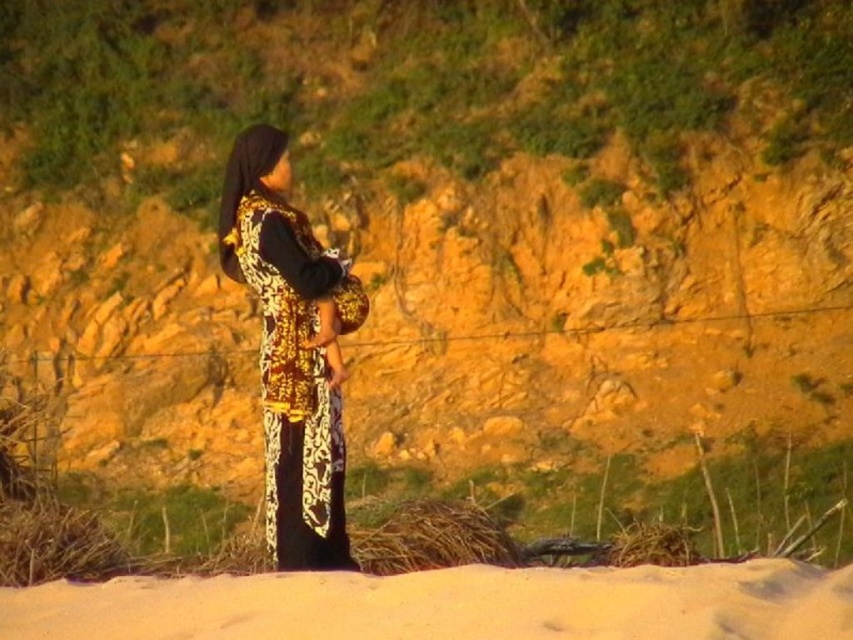
Which is in front, point (361, 611) or point (273, 385)?

Point (361, 611) is more forward.

Does sandy yellow sand at bottom have a lesser height compared to gold embroidered dress at center?

Indeed, sandy yellow sand at bottom has a lesser height compared to gold embroidered dress at center.

Who is more distant from viewer, (373, 595) or (300, 353)?

The point (300, 353) is more distant.

The height and width of the screenshot is (640, 853). I want to click on sandy yellow sand at bottom, so click(x=450, y=604).